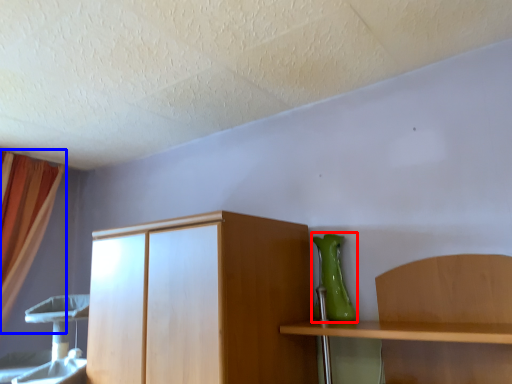
Question: Among these objects, which one is farthest to the camera, vase (highlighted by a red box) or curtain (highlighted by a blue box)?

Choices:
 (A) vase
 (B) curtain

Answer: (B)